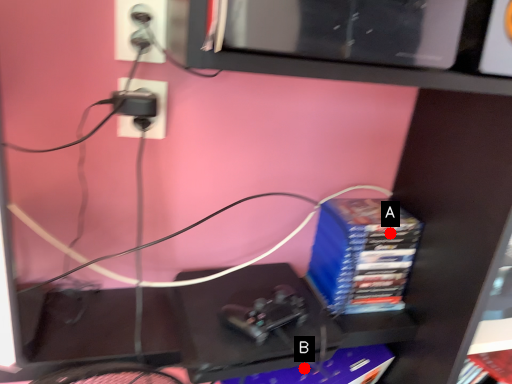
Question: Two points are circled on the image, labeled by A and B beside each circle. Which of the following is the farthest from the observer?

Choices:
 (A) A is further
 (B) B is further

Answer: (B)